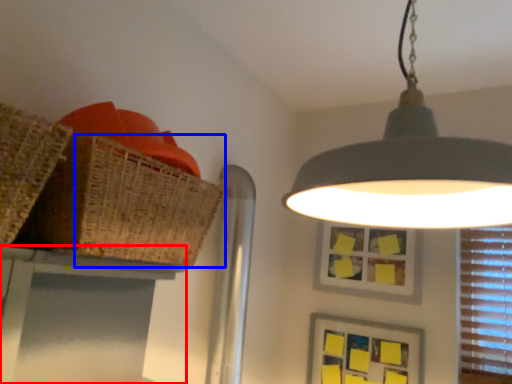
Question: Which point is closer to the camera, table (highlighted by a red box) or basket (highlighted by a blue box)?

Choices:
 (A) table
 (B) basket

Answer: (B)